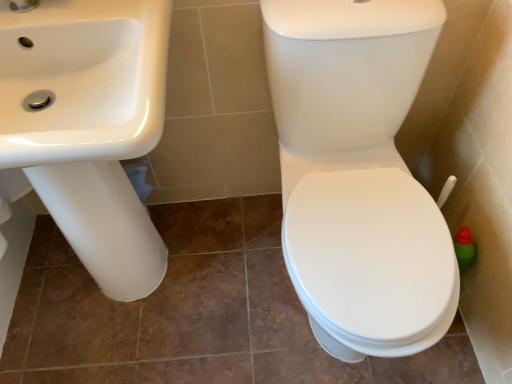
Question: Considering the positions of white glossy sink at left and white glossy toilet at right in the image, is white glossy sink at left taller or shorter than white glossy toilet at right?

Choices:
 (A) tall
 (B) short

Answer: (A)

Question: From the image's perspective, relative to white glossy toilet at right, is white glossy sink at left above or below?

Choices:
 (A) above
 (B) below

Answer: (A)

Question: Is white glossy sink at left bigger or smaller than white glossy toilet at right?

Choices:
 (A) small
 (B) big

Answer: (A)

Question: Is white glossy toilet at right spatially inside white glossy sink at left, or outside of it?

Choices:
 (A) outside
 (B) inside

Answer: (A)

Question: In terms of height, does white glossy toilet at right look taller or shorter compared to white glossy sink at left?

Choices:
 (A) tall
 (B) short

Answer: (B)

Question: Considering the positions of point (389, 210) and point (138, 288), is point (389, 210) closer or farther from the camera than point (138, 288)?

Choices:
 (A) farther
 (B) closer

Answer: (B)

Question: From the image's perspective, is white glossy toilet at right located above or below white glossy sink at left?

Choices:
 (A) above
 (B) below

Answer: (B)